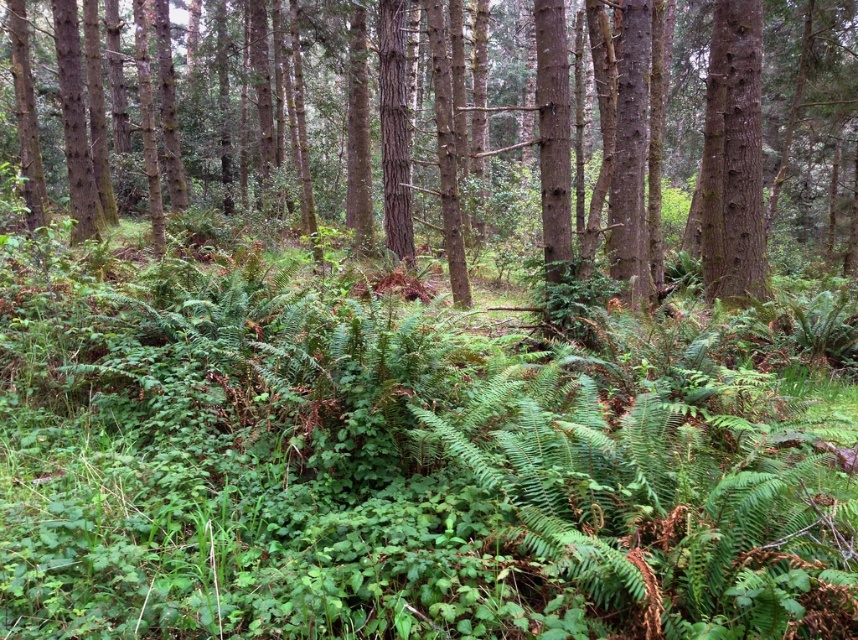
Question: Which object is closer to the camera taking this photo?

Choices:
 (A) smooth brown tree trunk at upper right
 (B) smooth bark tree at center

Answer: (B)

Question: Does smooth bark tree at center come in front of smooth brown tree trunk at upper right?

Choices:
 (A) yes
 (B) no

Answer: (A)

Question: Can you confirm if smooth bark tree at center is positioned above smooth brown tree trunk at upper right?

Choices:
 (A) no
 (B) yes

Answer: (B)

Question: In this image, where is smooth bark tree at center located relative to smooth brown tree trunk at upper right?

Choices:
 (A) left
 (B) right

Answer: (A)